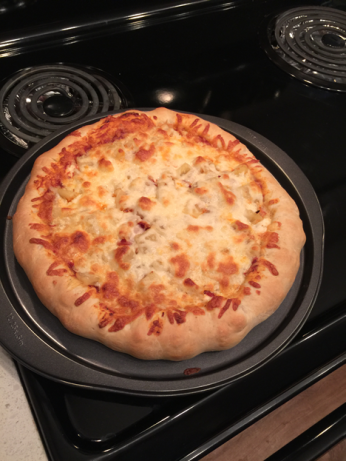
Image resolution: width=346 pixels, height=461 pixels. What are the coordinates of `oven top` in the screenshot? It's located at (139, 42).